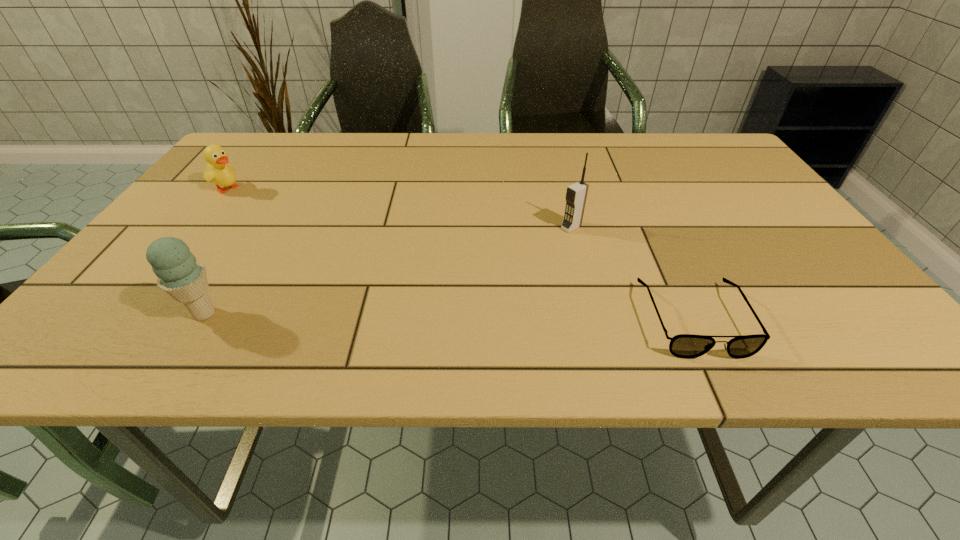
Locate an element on the screen. vacant position at the right edge of the desktop is located at coordinates (755, 211).

The image size is (960, 540). I want to click on free region at the near right corner of the desktop, so [x=797, y=308].

At what (x,y) coordinates should I click in order to perform the action: click on free spot between the ice cream and the rightmost object. Please return your answer as a coordinate pair (x, y). Image resolution: width=960 pixels, height=540 pixels. Looking at the image, I should click on (449, 316).

Where is `free space between the cellular telephone and the third object from right to left`? Image resolution: width=960 pixels, height=540 pixels. free space between the cellular telephone and the third object from right to left is located at coordinates (388, 271).

I want to click on blank region between the leftmost object and the third object from left to right, so click(400, 207).

I want to click on vacant area between the leftmost object and the third object from right to left, so click(x=217, y=251).

At what (x,y) coordinates should I click in order to perform the action: click on free spot between the third object from right to left and the second farthest object. Please return your answer as a coordinate pair (x, y). The height and width of the screenshot is (540, 960). Looking at the image, I should click on tap(388, 271).

Where is `free space between the second object from right to left and the ice cream`? free space between the second object from right to left and the ice cream is located at coordinates (388, 271).

I want to click on vacant area that lies between the second shortest object and the second object from left to right, so click(217, 251).

At what (x,y) coordinates should I click in order to perform the action: click on vacant region between the ice cream and the rightmost object. Please return your answer as a coordinate pair (x, y). Image resolution: width=960 pixels, height=540 pixels. Looking at the image, I should click on (449, 316).